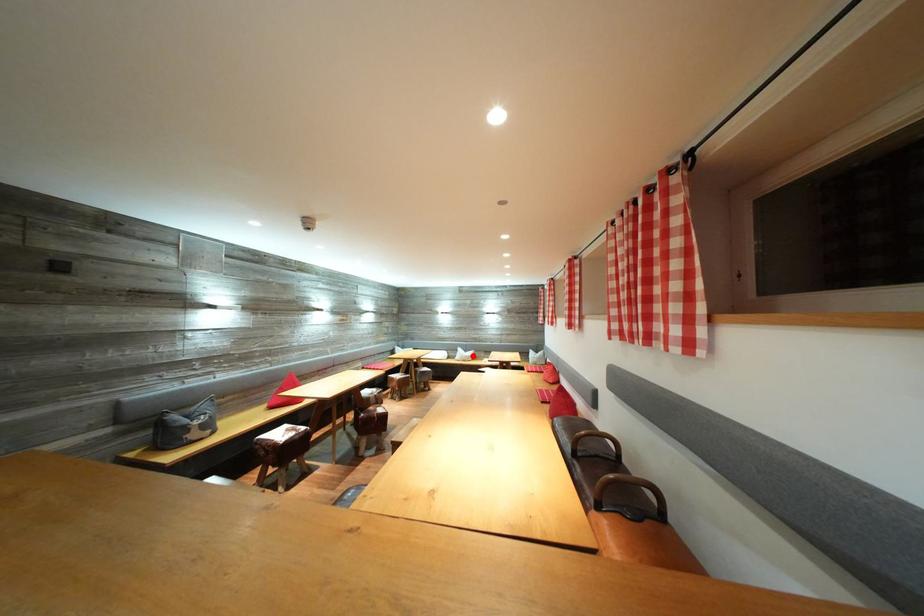
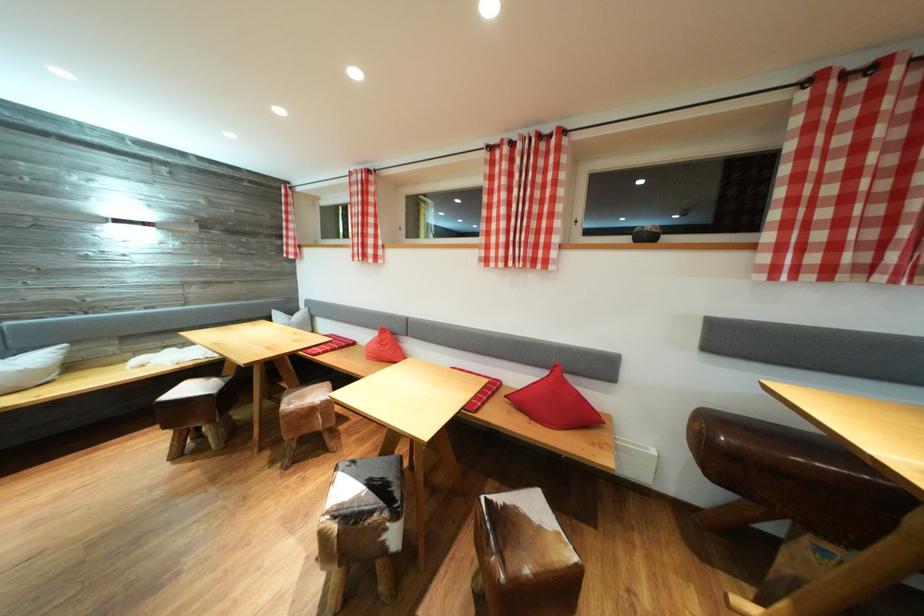
The point at the highlighted location is marked in the first image. Where is the corresponding point in the second image?

(14, 358)